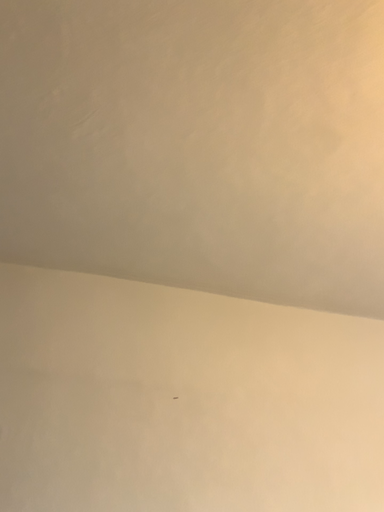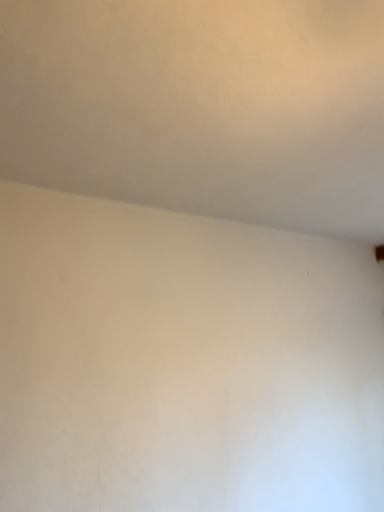
Question: Which way did the camera rotate in the video?

Choices:
 (A) rotated left
 (B) rotated right

Answer: (B)